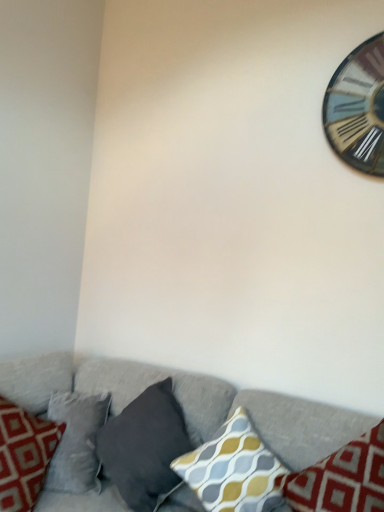
Question: Is yellow-gray patterned cushion at center, the second pillow from the right, positioned before dark gray fabric pillow at lower center, arranged as the 1th pillow when viewed from the left?

Choices:
 (A) no
 (B) yes

Answer: (B)

Question: From the image's perspective, would you say yellow-gray patterned cushion at center, the second pillow from the right, is shown under dark gray fabric pillow at lower center, arranged as the 1th pillow when viewed from the left?

Choices:
 (A) no
 (B) yes

Answer: (B)

Question: From a real-world perspective, is yellow-gray patterned cushion at center, arranged as the second pillow when viewed from the left, physically below dark gray fabric pillow at lower center, arranged as the 1th pillow when viewed from the left?

Choices:
 (A) yes
 (B) no

Answer: (B)

Question: From the image's perspective, is yellow-gray patterned cushion at center, the second pillow from the right, on dark gray fabric pillow at lower center, arranged as the 1th pillow when viewed from the left?

Choices:
 (A) yes
 (B) no

Answer: (B)

Question: Is yellow-gray patterned cushion at center, the second pillow from the right, wider than dark gray fabric pillow at lower center, arranged as the 1th pillow when viewed from the left?

Choices:
 (A) yes
 (B) no

Answer: (B)

Question: Looking at the image, does yellow-gray patterned cushion at center, the second pillow from the right, seem bigger or smaller compared to textured gray couch at lower center?

Choices:
 (A) small
 (B) big

Answer: (A)

Question: In terms of height, does yellow-gray patterned cushion at center, the second pillow from the right, look taller or shorter compared to textured gray couch at lower center?

Choices:
 (A) tall
 (B) short

Answer: (B)

Question: Do you think yellow-gray patterned cushion at center, the second pillow from the right, is within textured gray couch at lower center, or outside of it?

Choices:
 (A) outside
 (B) inside

Answer: (B)

Question: Does point (177, 466) appear closer or farther from the camera than point (61, 365)?

Choices:
 (A) closer
 (B) farther

Answer: (A)

Question: From the image's perspective, is dark gray fabric pillow at lower center, arranged as the 1th pillow when viewed from the left, positioned above or below textured gray couch at lower center?

Choices:
 (A) below
 (B) above

Answer: (B)

Question: Considering their positions, is dark gray fabric pillow at lower center, arranged as the 1th pillow when viewed from the left, located in front of or behind textured gray couch at lower center?

Choices:
 (A) behind
 (B) front

Answer: (A)

Question: Would you say dark gray fabric pillow at lower center, arranged as the 1th pillow when viewed from the left, is to the left or to the right of textured gray couch at lower center in the picture?

Choices:
 (A) left
 (B) right

Answer: (B)

Question: Is point (140, 395) closer or farther from the camera than point (236, 395)?

Choices:
 (A) farther
 (B) closer

Answer: (A)

Question: Is point (369, 460) positioned closer to the camera than point (182, 414)?

Choices:
 (A) closer
 (B) farther

Answer: (A)

Question: Would you say yellow-gray patterned pillow at lower right, which is the first pillow from right to left, is inside or outside dark gray fabric pillow at lower center, which ranks as the 3th pillow in right-to-left order?

Choices:
 (A) inside
 (B) outside

Answer: (B)